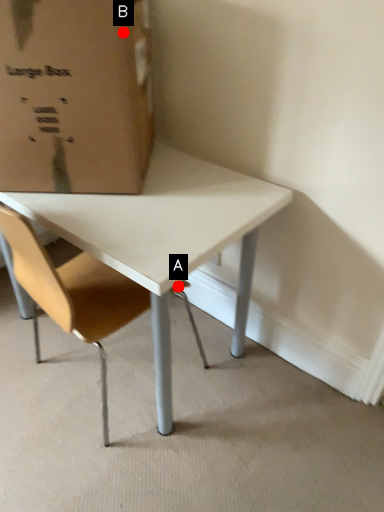
Question: Two points are circled on the image, labeled by A and B beside each circle. Which point appears closest to the camera in this image?

Choices:
 (A) A is closer
 (B) B is closer

Answer: (B)